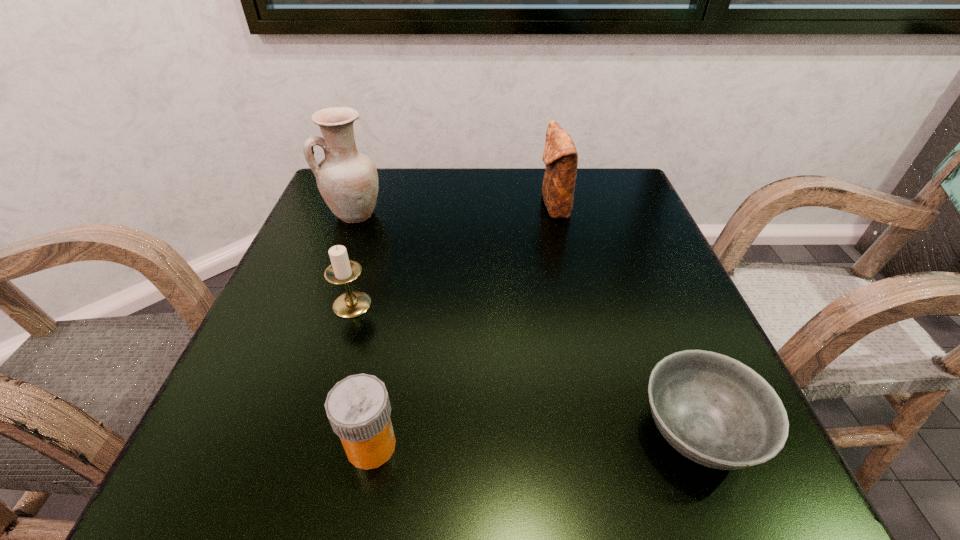
At what (x,y) coordinates should I click in order to perform the action: click on pottery situated at the left edge. Please return your answer as a coordinate pair (x, y). This screenshot has height=540, width=960. Looking at the image, I should click on (347, 180).

In order to click on candle holder that is at the left edge in this screenshot , I will do `click(342, 270)`.

Locate an element on the screen. This screenshot has width=960, height=540. object situated at the right edge is located at coordinates (716, 411).

Locate an element on the screen. This screenshot has width=960, height=540. object situated at the far left corner is located at coordinates (347, 180).

Image resolution: width=960 pixels, height=540 pixels. I want to click on object that is at the near right corner, so click(716, 411).

This screenshot has height=540, width=960. Identify the location of free space at the far edge. (505, 184).

You are a GUI agent. You are given a task and a screenshot of the screen. Output one action in this format:
    pyautogui.click(x=<x>, y=<y>)
    Task: Click on the vacant space at the near edge of the desktop
    Image resolution: width=960 pixels, height=540 pixels.
    Given the screenshot: What is the action you would take?
    pyautogui.click(x=602, y=458)

Locate an element on the screen. vacant space at the left edge is located at coordinates (300, 270).

The image size is (960, 540). In the image, there is a desktop. What are the coordinates of `vacant space at the right edge` in the screenshot? It's located at (670, 292).

Where is `vacant region at the far left corner of the desktop`? The image size is (960, 540). vacant region at the far left corner of the desktop is located at coordinates (375, 215).